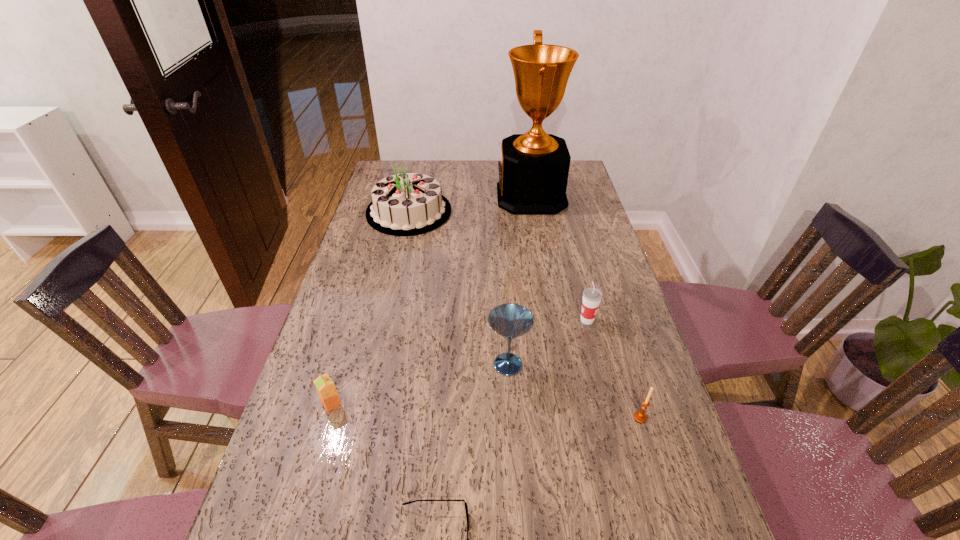
Where is `trophy cup`? trophy cup is located at coordinates (533, 172).

At what (x,y) coordinates should I click in order to perform the action: click on birthday cake. Please return your answer as a coordinate pair (x, y). The width and height of the screenshot is (960, 540). Looking at the image, I should click on (408, 204).

Identify the location of the fourth farthest object. Image resolution: width=960 pixels, height=540 pixels. (510, 321).

Where is `martini`? The image size is (960, 540). martini is located at coordinates (510, 321).

Locate an element on the screen. The height and width of the screenshot is (540, 960). the fifth nearest object is located at coordinates (592, 296).

This screenshot has width=960, height=540. Identify the location of the fourth tallest object. (592, 296).

You are a GUI agent. You are given a task and a screenshot of the screen. Output one action in this format:
    pyautogui.click(x=<x>, y=<y>)
    Task: Click on the candle_holder
    The width and height of the screenshot is (960, 540).
    Given the screenshot: What is the action you would take?
    pyautogui.click(x=640, y=416)

I want to click on the rightmost object, so click(x=640, y=416).

What are the coordinates of `the second shortest object` in the screenshot? It's located at (325, 387).

Identify the location of vacant area located 0.080m on the front of the tallest object with the label. (478, 197).